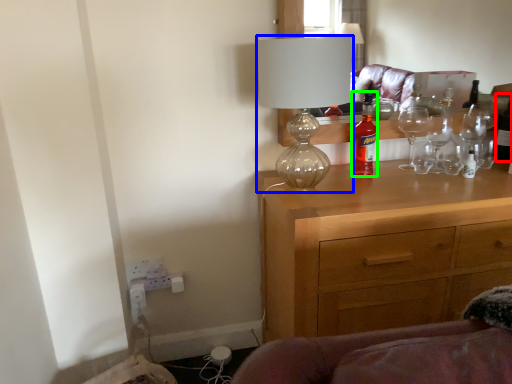
Question: Which object is positioned farthest from bottle (highlighted by a red box)? Select from lamp (highlighted by a blue box) and bottle (highlighted by a green box).

Choices:
 (A) lamp
 (B) bottle

Answer: (A)